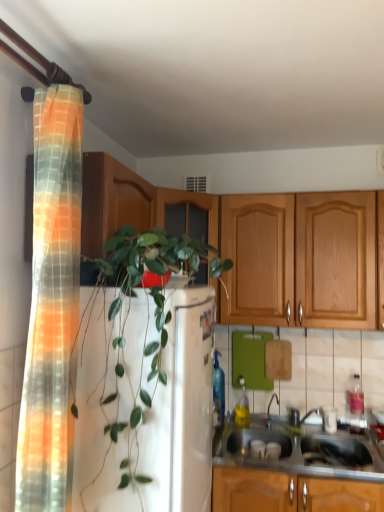
What do you see at coordinates (290, 473) in the screenshot? I see `stainless steel sink at lower right` at bounding box center [290, 473].

The height and width of the screenshot is (512, 384). What are the coordinates of `green matte cutting board at center, acting as the first appliance starting from the back` in the screenshot? It's located at (250, 360).

What are the coordinates of `wooden cabinet at upper left` in the screenshot? It's located at (112, 201).

In order to click on green leafy plant at center in this screenshot , I will do `click(146, 379)`.

Are metallic silver faucet at sink right and translucent orange-yellow fabric at left making contact?

No, metallic silver faucet at sink right is not next to translucent orange-yellow fabric at left.

Does metallic silver faucet at sink right appear on the right side of translucent orange-yellow fabric at left?

Indeed, metallic silver faucet at sink right is positioned on the right side of translucent orange-yellow fabric at left.

Is point (269, 413) closer or farther from the camera than point (80, 192)?

Clearly, point (269, 413) is more distant from the camera than point (80, 192).

In the image, is metallic silver faucet at sink right positioned in front of or behind translucent orange-yellow fabric at left?

metallic silver faucet at sink right is positioned farther from the viewer than translucent orange-yellow fabric at left.

Is stainless steel sink at lower right inside translucent orange-yellow fabric at left?

No, stainless steel sink at lower right is not a part of translucent orange-yellow fabric at left.

Can you tell me how much translucent orange-yellow fabric at left and stainless steel sink at lower right differ in facing direction?

The facing directions of translucent orange-yellow fabric at left and stainless steel sink at lower right are 89.8 degrees apart.

From a real-world perspective, is translucent orange-yellow fabric at left on top of stainless steel sink at lower right?

Indeed, from a real-world perspective, translucent orange-yellow fabric at left stands above stainless steel sink at lower right.

From the image's perspective, between translucent orange-yellow fabric at left and stainless steel sink at lower right, who is located below?

From the image's view, stainless steel sink at lower right is below.

From the picture: From a real-world perspective, is green leafy plant at center under stainless steel sink at lower right?

No.

Consider the image. Who is smaller, green leafy plant at center or stainless steel sink at lower right?

Smaller between the two is stainless steel sink at lower right.

From the image's perspective, is green leafy plant at center above or below stainless steel sink at lower right?

Clearly, from the image's perspective, green leafy plant at center is above stainless steel sink at lower right.

How distant is green leafy plant at center from stainless steel sink at lower right?

green leafy plant at center and stainless steel sink at lower right are 27.32 inches apart from each other.

In the image, is stainless steel sink at lower right on the left side or the right side of white plastic container at lower right, which ranks as the second appliance in left-to-right order?

From the image, it's evident that stainless steel sink at lower right is to the left of white plastic container at lower right, which ranks as the second appliance in left-to-right order.

Which of these two, stainless steel sink at lower right or white plastic container at lower right, the 2th appliance in the top-to-bottom sequence, is thinner?

white plastic container at lower right, the 2th appliance in the top-to-bottom sequence.

This screenshot has height=512, width=384. In the image, there is a white plastic container at lower right, marked as the first appliance in a bottom-to-top arrangement. Find the location of `countertop below it (from the image's perspective)`. countertop below it (from the image's perspective) is located at coordinates (x=290, y=473).

From the image's perspective, between stainless steel sink at lower right and white plastic container at lower right, the 2th appliance in the top-to-bottom sequence, who is located below?

stainless steel sink at lower right.

Identify the location of countertop that appears on the right of metallic silver faucet at sink right. Image resolution: width=384 pixels, height=512 pixels. (290, 473).

Choose the correct answer: Is stainless steel sink at lower right inside metallic silver faucet at sink right or outside it?

stainless steel sink at lower right is not inside metallic silver faucet at sink right, it's outside.

Are stainless steel sink at lower right and metallic silver faucet at sink right far apart?

No, there isn't a large distance between stainless steel sink at lower right and metallic silver faucet at sink right.

From a real-world perspective, which object stands above the other?

From a 3D spatial view, metallic silver faucet at sink right is above.

From the image's perspective, is stainless steel sink at lower right located above green leafy plant at center?

No, from the image's perspective, stainless steel sink at lower right is not over green leafy plant at center.

Can you confirm if stainless steel sink at lower right is thinner than green leafy plant at center?

Indeed, stainless steel sink at lower right has a lesser width compared to green leafy plant at center.

Is green leafy plant at center surrounded by stainless steel sink at lower right?

Definitely not — green leafy plant at center is not inside stainless steel sink at lower right.

Is metallic silver faucet at sink right not close to wooden cabinet at upper left?

metallic silver faucet at sink right is far away from wooden cabinet at upper left.

Is metallic silver faucet at sink right smaller than wooden cabinet at upper left?

Correct, metallic silver faucet at sink right occupies less space than wooden cabinet at upper left.

Can you confirm if metallic silver faucet at sink right is thinner than wooden cabinet at upper left?

Yes.

Find the location of `faucet that is on the right side of translucent orange-yellow fabric at left`. faucet that is on the right side of translucent orange-yellow fabric at left is located at coordinates (269, 410).

The width and height of the screenshot is (384, 512). In order to click on countertop directly beneath the translucent orange-yellow fabric at left (from a real-world perspective) in this screenshot , I will do `click(290, 473)`.

From the image, which object appears to be nearer to stainless steel sink at lower right, metallic silver faucet at sink right or translucent orange-yellow fabric at left?

metallic silver faucet at sink right is positioned closer to the anchor stainless steel sink at lower right.

From the image, which object appears to be nearer to wooden cabinet at upper left, stainless steel sink at lower right or green matte cutting board at center, the first appliance from the top?

green matte cutting board at center, the first appliance from the top.

When comparing their distances from green leafy plant at center, does stainless steel sink at lower right or translucent orange-yellow fabric at left seem further?

stainless steel sink at lower right is further to green leafy plant at center.

Considering their positions, is green leafy plant at center positioned further to white plastic container at lower right, the second appliance from the back, than green matte cutting board at center, the first appliance from the left?

green leafy plant at center is further to white plastic container at lower right, the second appliance from the back.

In the scene shown: Looking at the image, which one is located further to white plastic container at lower right, the 1th appliance positioned from the right, green leafy plant at center or metallic silver faucet at sink right?

green leafy plant at center.

Which object lies further to the anchor point green leafy plant at center, translucent orange-yellow fabric at left or stainless steel sink at lower right?

Among the two, stainless steel sink at lower right is located further to green leafy plant at center.

When comparing their distances from translucent orange-yellow fabric at left, does stainless steel sink at lower right or green matte cutting board at center, the first appliance from the top, seem further?

Among the two, green matte cutting board at center, the first appliance from the top, is located further to translucent orange-yellow fabric at left.

When comparing their distances from stainless steel sink at lower right, does green leafy plant at center or wooden cabinet at upper left seem further?

Among the two, wooden cabinet at upper left is located further to stainless steel sink at lower right.

Find the location of a particular element. faucet between green leafy plant at center and green matte cutting board at center, positioned as the second appliance in right-to-left order, in the front-back direction is located at coordinates (269, 410).

Identify the location of faucet located between translucent orange-yellow fabric at left and stainless steel sink at lower right in the left-right direction. The image size is (384, 512). (269, 410).

Find the location of a particular element. This screenshot has height=512, width=384. countertop positioned between green leafy plant at center and metallic silver faucet at sink right from near to far is located at coordinates 290,473.

Locate an element on the screen. The height and width of the screenshot is (512, 384). cabinetry located between green leafy plant at center and metallic silver faucet at sink right in the depth direction is located at coordinates (112, 201).